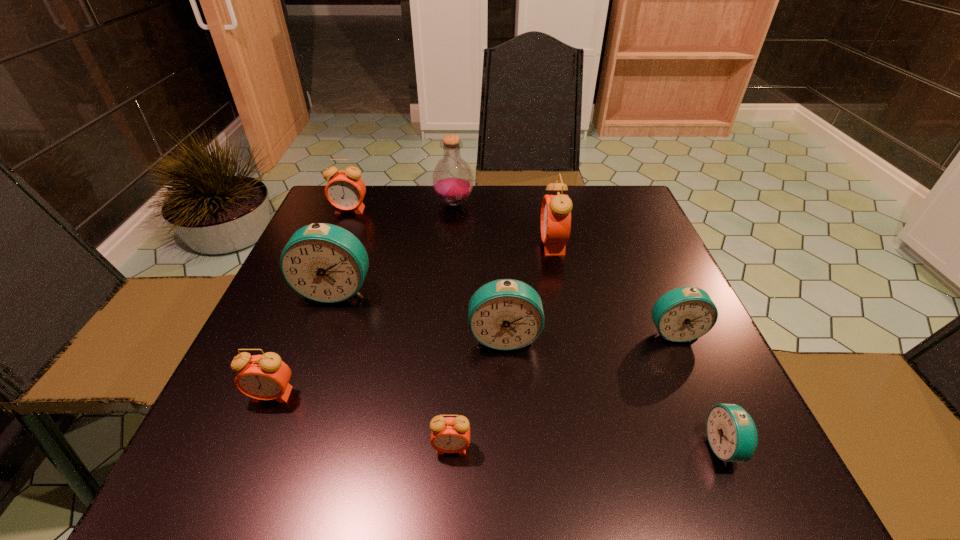
This screenshot has width=960, height=540. What are the coordinates of `free point between the second pink alarm clock from right to left and the second biggest blue alarm clock` in the screenshot? It's located at (478, 392).

Identify the location of vacant space that's between the smallest blue alarm clock and the third blue alarm clock from right to left. coord(614,392).

The height and width of the screenshot is (540, 960). I want to click on vacant region between the farthest pink alarm clock and the second farthest pink alarm clock, so click(x=451, y=227).

At what (x,y) coordinates should I click in order to perform the action: click on object that is the fifth nearest to the third biggest blue alarm clock. Please return your answer as a coordinate pair (x, y). Looking at the image, I should click on (452, 179).

This screenshot has width=960, height=540. In order to click on object that is the closest one to the second nearest pink alarm clock in this screenshot , I will do `click(325, 263)`.

Locate which alarm clock is the closest to the farthest alarm clock. Please provide its 2D coordinates. Your answer should be formatted as a tuple, i.e. [(x, y)], where the tuple contains the x and y coordinates of a point satisfying the conditions above.

[(325, 263)]

The height and width of the screenshot is (540, 960). I want to click on the closest alarm clock to the nearest blue alarm clock, so click(x=683, y=314).

Where is `pink alarm clock that stands as the closest to the second smallest pink alarm clock`? Image resolution: width=960 pixels, height=540 pixels. pink alarm clock that stands as the closest to the second smallest pink alarm clock is located at coordinates (448, 435).

Identify the location of pink alarm clock that stands as the fourth closest to the second biggest blue alarm clock. Image resolution: width=960 pixels, height=540 pixels. (345, 190).

Choose which blue alarm clock is the third nearest neighbor to the nearest blue alarm clock. Please provide its 2D coordinates. Your answer should be formatted as a tuple, i.e. [(x, y)], where the tuple contains the x and y coordinates of a point satisfying the conditions above.

[(325, 263)]